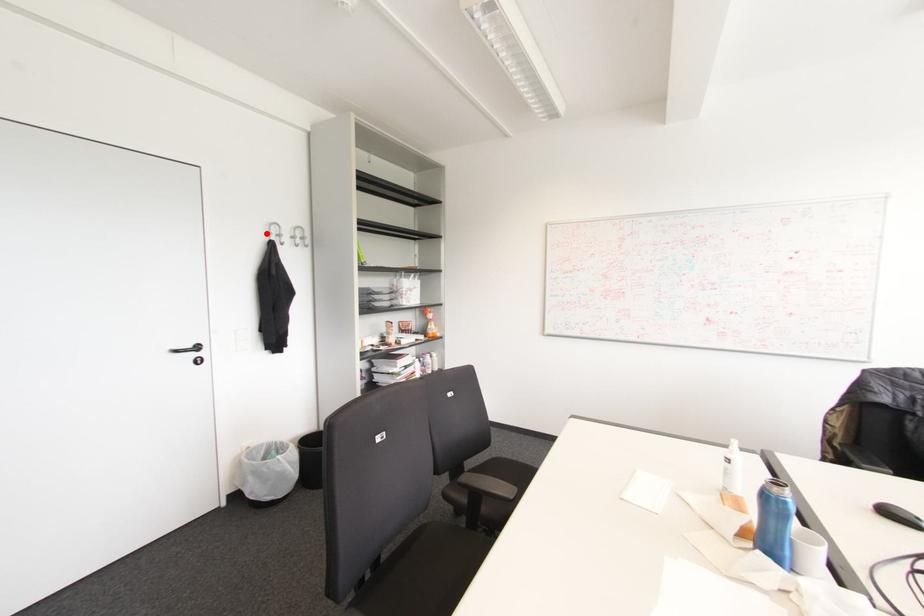
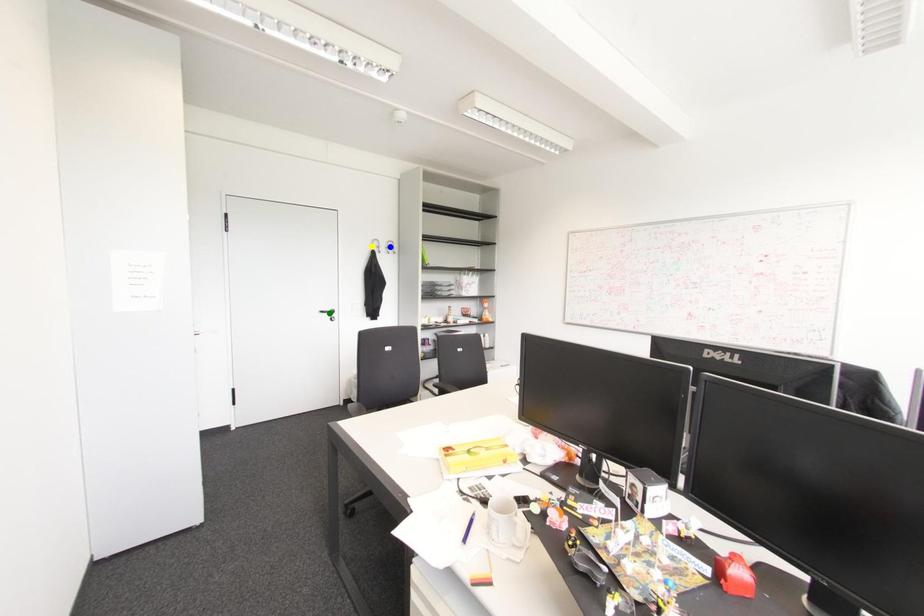
Question: I am providing you with two images of the same scene from different viewpoints. A red point is marked on the first image. You are given multiple points on the second image. Can you choose the point in image 2 that corresponds to the point in image 1?

Choices:
 (A) green point
 (B) yellow point
 (C) blue point

Answer: (B)